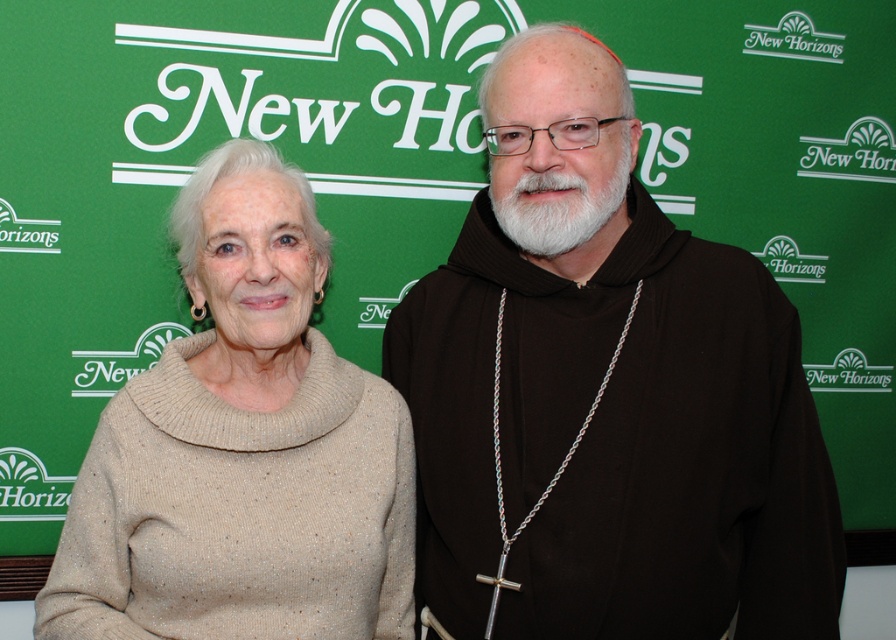
Does brown woolen robe at center lie behind beige sweater at left?

That is True.

Which is more to the right, brown woolen robe at center or beige sweater at left?

brown woolen robe at center is more to the right.

Which is in front, point (674, 416) or point (164, 572)?

Positioned in front is point (164, 572).

Where is `brown woolen robe at center`? Image resolution: width=896 pixels, height=640 pixels. brown woolen robe at center is located at coordinates (605, 394).